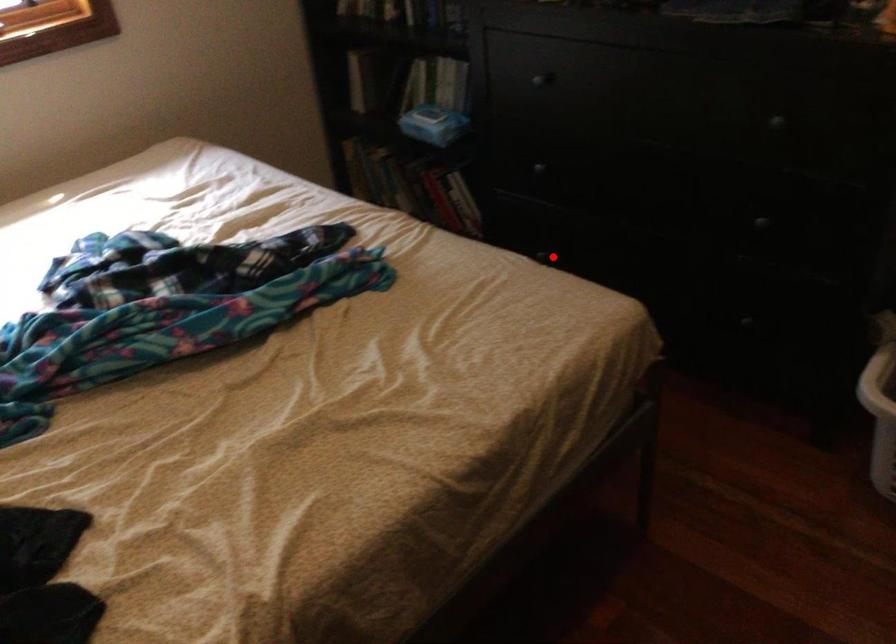
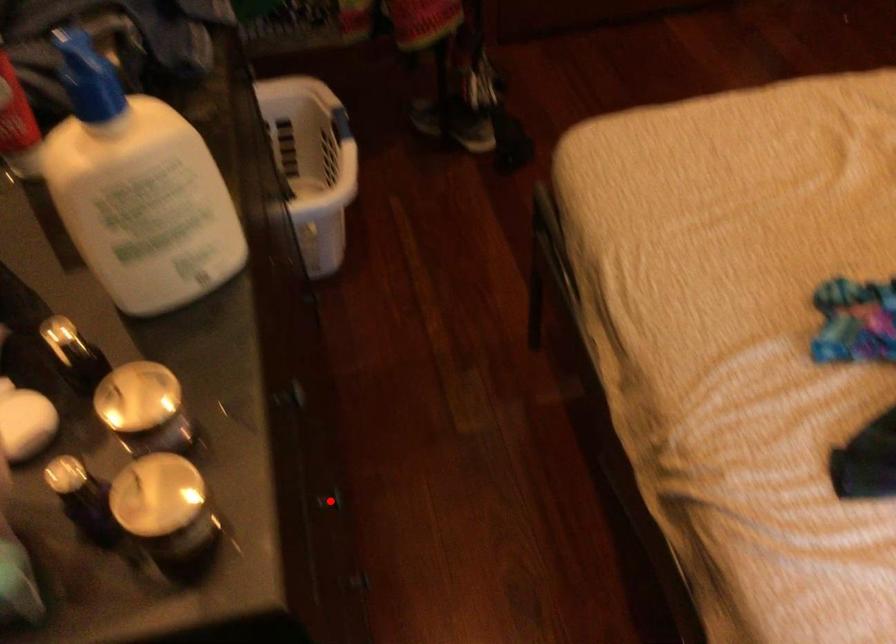
I am providing you with two images of the same scene from different viewpoints. A red point is marked on the first image and another point is marked on the second image. Is the red point in image1 aligned with the point shown in image2?

No